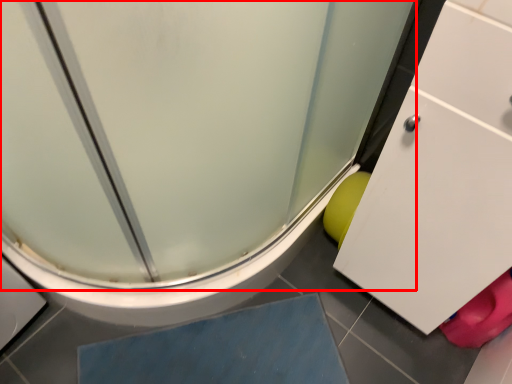
Question: In this image, where is screen door (annotated by the red box) located relative to slate?

Choices:
 (A) left
 (B) right

Answer: (A)